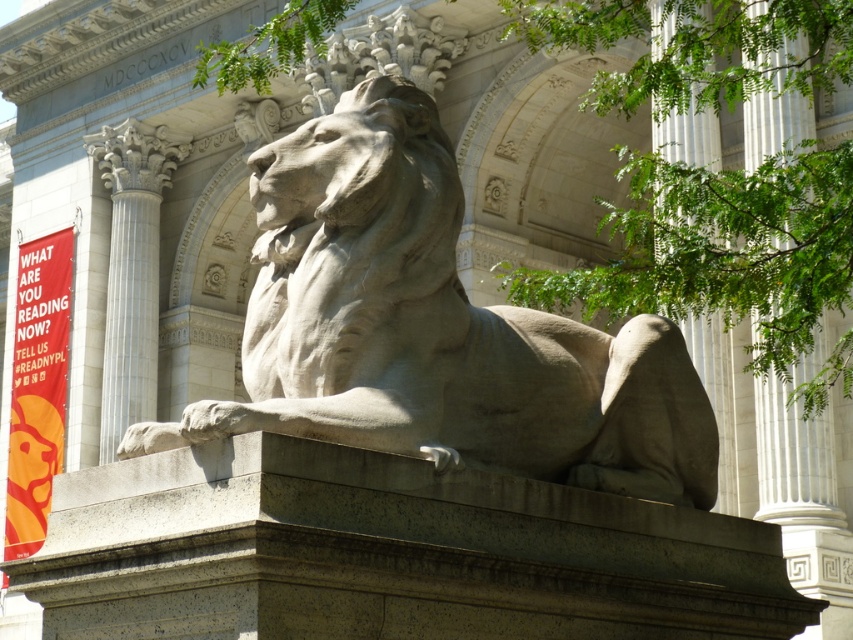
You are an art conservator assessing the stone sculpture. You notice the gray stone lion at center and the gray stone paw at lower left. Which object has a smaller width?

The gray stone lion at center has a lesser width compared to the gray stone paw at lower left, so the gray stone lion at center is smaller in width.

You are an art conservator standing 100 meters away from the sculpture. You need to inspect the white marble column at center. Can you walk directly towards it without needing to go around any obstacles?

The white marble column at center is 94.25 meters away from the viewer. Since you are standing 100 meters away from the sculpture, you are farther than the column, so you can walk directly towards it without obstacles.